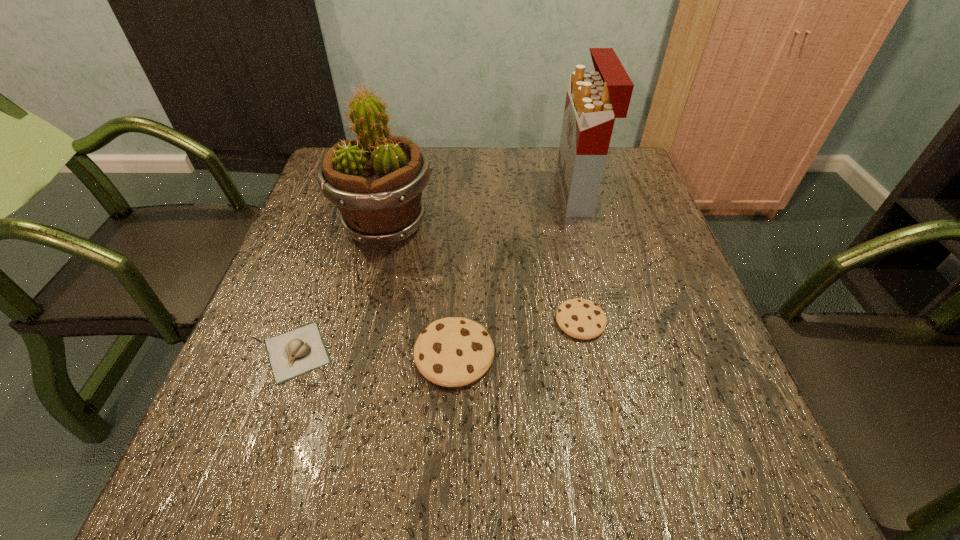
Find the location of `free space at the far edge of the desktop`. free space at the far edge of the desktop is located at coordinates coord(439,187).

You are a GUI agent. You are given a task and a screenshot of the screen. Output one action in this format:
    pyautogui.click(x=<x>, y=<y>)
    Task: Click on the free space at the near edge of the desktop
    
    Given the screenshot: What is the action you would take?
    pyautogui.click(x=426, y=431)

Locate an element on the screen. The width and height of the screenshot is (960, 540). free space at the right edge of the desktop is located at coordinates (634, 218).

In the image, there is a desktop. Identify the location of vacant space at the far right corner. (613, 153).

What are the coordinates of `free space at the near right corner` in the screenshot? It's located at (712, 393).

Find the location of a particular element. free point between the left cookie and the right cookie is located at coordinates (517, 338).

Image resolution: width=960 pixels, height=540 pixels. What are the coordinates of `vacant area between the cigarette case and the flowerpot` in the screenshot? It's located at (481, 210).

Where is `free space between the flowerpot and the shortest object`? This screenshot has height=540, width=960. free space between the flowerpot and the shortest object is located at coordinates (342, 289).

The width and height of the screenshot is (960, 540). In order to click on empty space that is in between the shortest object and the flowerpot in this screenshot , I will do (x=342, y=289).

I want to click on empty location between the third tallest object and the cigarette case, so click(x=516, y=274).